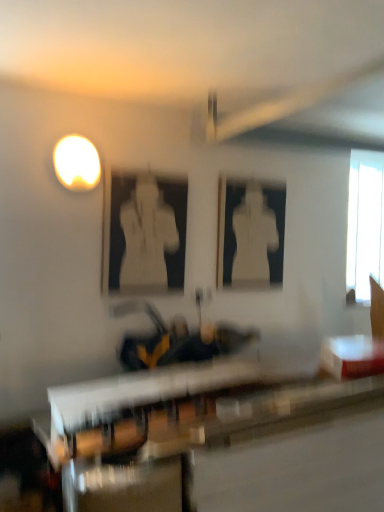
Question: Visually, is transparent glass window at upper right positioned to the left or to the right of white glossy table at lower right, which is the 1th table in top-to-bottom order?

Choices:
 (A) left
 (B) right

Answer: (B)

Question: From the image's perspective, is transparent glass window at upper right above or below white glossy table at lower right, arranged as the second table when ordered from the bottom?

Choices:
 (A) above
 (B) below

Answer: (A)

Question: Estimate the real-world distances between objects in this image. Which object is closer to the matte white light at upper left?

Choices:
 (A) white glossy statue at center, which is the first person from front to back
 (B) transparent glass window at upper right
 (C) wooden table at center, the first table in the bottom-to-top sequence
 (D) white glossy statue at center, which is the 2th person from front to back
 (E) white glossy table at lower right, arranged as the second table when ordered from the bottom

Answer: (A)

Question: Which is farther from the white glossy statue at center, which ranks as the first person in right-to-left order?

Choices:
 (A) transparent glass window at upper right
 (B) wooden table at center, marked as the 2th table in a top-to-bottom arrangement
 (C) white glossy table at lower right, which is the 1th table in top-to-bottom order
 (D) matte white light at upper left
 (E) white glossy statue at center, which is the first person from front to back

Answer: (B)